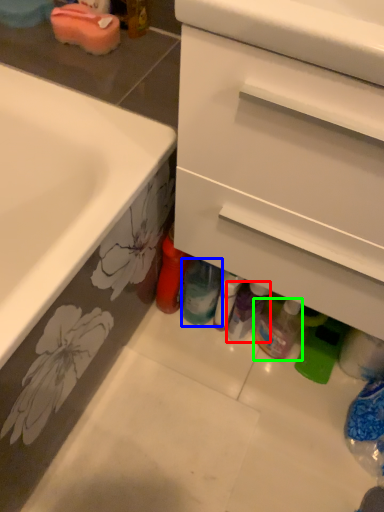
Question: Estimate the real-world distances between objects in this image. Which object is closer to toiletry (highlighted by a red box), bottle (highlighted by a blue box) or bottle (highlighted by a green box)?

Choices:
 (A) bottle
 (B) bottle

Answer: (B)